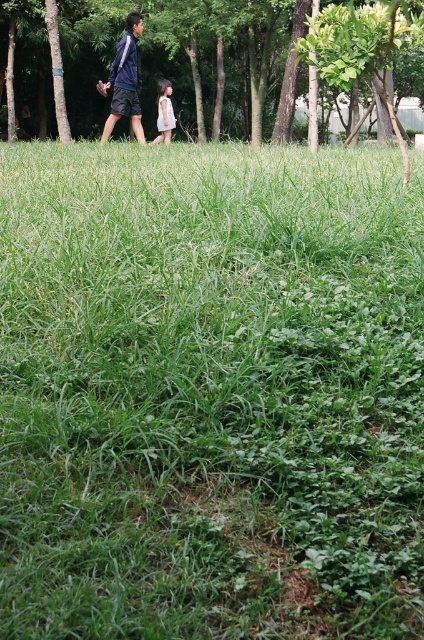
You are standing in the park and see the green leafy tree at upper center and the blue fabric jacket at upper left. Which object is closer to you?

The green leafy tree at upper center is closer to you because the blue fabric jacket at upper left is behind it.

You are planning to set up a picnic blanket in the park. The picnic blanket is 1.5 meters wide. Can you place it between the green leafy tree at upper center and the light pink fabric dress at center without overlapping either?

The green leafy tree at upper center is thinner than the light pink fabric dress at center. Since the tree is thinner, the space between them may be sufficient, but the exact width isn

You are standing in the park and want to place a small flag at the point closer to you between the two points marked as point (136, 140) and point (159, 112). Which point should you choose?

You should choose point (136, 140) because it is closer to you than point (159, 112).